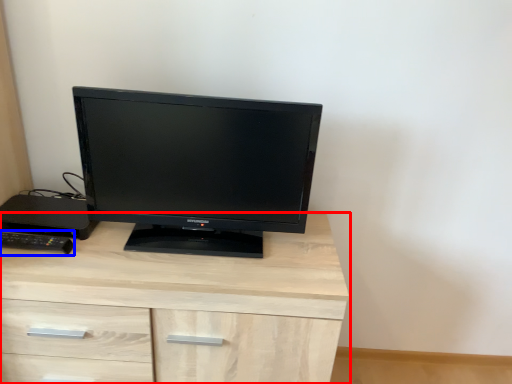
Question: Which object is closer to the camera taking this photo, chest of drawers (highlighted by a red box) or desktop (highlighted by a blue box)?

Choices:
 (A) chest of drawers
 (B) desktop

Answer: (A)